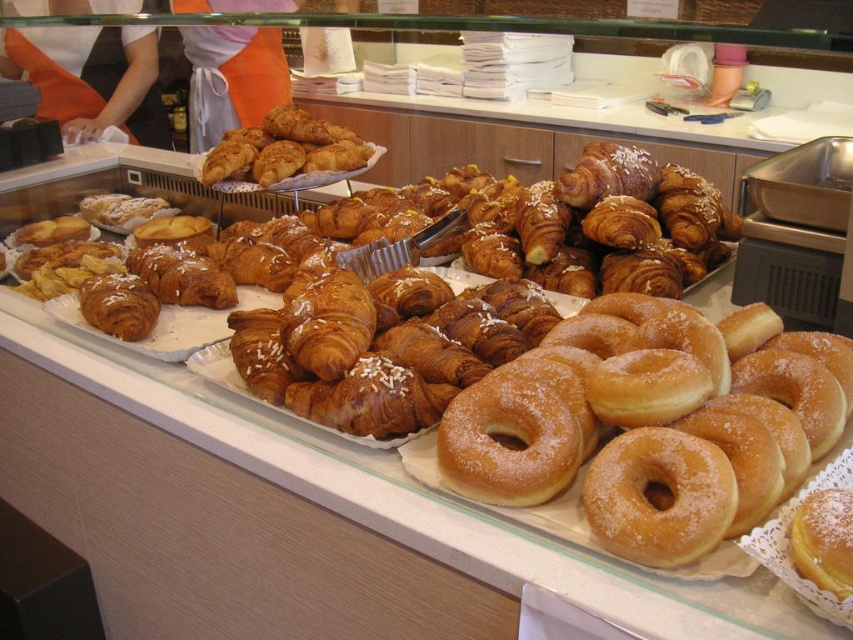
Question: Can you confirm if glossy sugar-coated donut at center is bigger than golden brown croissant at center?

Choices:
 (A) no
 (B) yes

Answer: (B)

Question: Does glossy sugar-coated donut at center have a larger size compared to golden brown croissant at center?

Choices:
 (A) no
 (B) yes

Answer: (B)

Question: Which of the following is the closest to the observer?

Choices:
 (A) golden brown croissant at center
 (B) glossy sugar-coated donut at center

Answer: (B)

Question: Which point appears farthest from the camera in this image?

Choices:
 (A) (581, 392)
 (B) (231, 154)

Answer: (B)

Question: Is glossy sugar-coated donut at center wider than golden brown croissant at center?

Choices:
 (A) yes
 (B) no

Answer: (A)